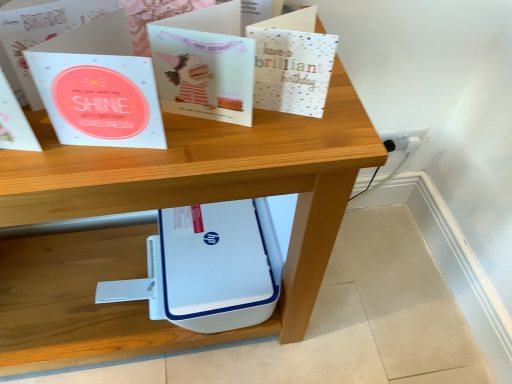
Question: Is the depth of matte paper card at center, which ranks as the 2th paperback book in right-to-left order, greater than that of light blue paper at center, which is counted as the third paperback book, starting from the right?

Choices:
 (A) no
 (B) yes

Answer: (B)

Question: Does matte paper card at center, acting as the second paperback book starting from the left, have a lesser width compared to light blue paper at center, which is the 1th paperback book in left-to-right order?

Choices:
 (A) no
 (B) yes

Answer: (B)

Question: Considering the relative sizes of matte paper card at center, which ranks as the 2th paperback book in right-to-left order, and light blue paper at center, which is counted as the third paperback book, starting from the right, in the image provided, is matte paper card at center, which ranks as the 2th paperback book in right-to-left order, wider than light blue paper at center, which is counted as the third paperback book, starting from the right,?

Choices:
 (A) no
 (B) yes

Answer: (A)

Question: Is matte paper card at center, which ranks as the 2th paperback book in right-to-left order, not inside light blue paper at center, which is the 1th paperback book in left-to-right order?

Choices:
 (A) no
 (B) yes

Answer: (B)

Question: Is matte paper card at center, which ranks as the 2th paperback book in right-to-left order, oriented away from light blue paper at center, which is the 1th paperback book in left-to-right order?

Choices:
 (A) yes
 (B) no

Answer: (B)

Question: Is metallic silver card at upper center, which appears as the first paperback book when viewed from the right, situated inside white plastic printer at center or outside?

Choices:
 (A) outside
 (B) inside

Answer: (A)

Question: Based on their sizes in the image, would you say metallic silver card at upper center, which appears as the first paperback book when viewed from the right, is bigger or smaller than white plastic printer at center?

Choices:
 (A) small
 (B) big

Answer: (A)

Question: From a real-world perspective, relative to white plastic printer at center, is metallic silver card at upper center, which appears as the first paperback book when viewed from the right, vertically above or below?

Choices:
 (A) above
 (B) below

Answer: (A)

Question: Is point (281, 72) closer or farther from the camera than point (163, 173)?

Choices:
 (A) farther
 (B) closer

Answer: (A)

Question: In terms of width, does light blue paper at center, which is counted as the third paperback book, starting from the right, look wider or thinner when compared to matte paper card at center, acting as the second paperback book starting from the left?

Choices:
 (A) wide
 (B) thin

Answer: (A)

Question: Choose the correct answer: Is light blue paper at center, which is the 1th paperback book in left-to-right order, inside matte paper card at center, which ranks as the 2th paperback book in right-to-left order, or outside it?

Choices:
 (A) inside
 (B) outside

Answer: (B)

Question: From a real-world perspective, is light blue paper at center, which is counted as the third paperback book, starting from the right, above or below matte paper card at center, acting as the second paperback book starting from the left?

Choices:
 (A) below
 (B) above

Answer: (B)

Question: From the image's perspective, relative to matte paper card at center, which ranks as the 2th paperback book in right-to-left order, is light blue paper at center, which is counted as the third paperback book, starting from the right, above or below?

Choices:
 (A) below
 (B) above

Answer: (A)

Question: From the image's perspective, relative to white plastic printer at center, is white plastic socket at lower right above or below?

Choices:
 (A) above
 (B) below

Answer: (A)

Question: Is white plastic socket at lower right taller or shorter than white plastic printer at center?

Choices:
 (A) tall
 (B) short

Answer: (B)